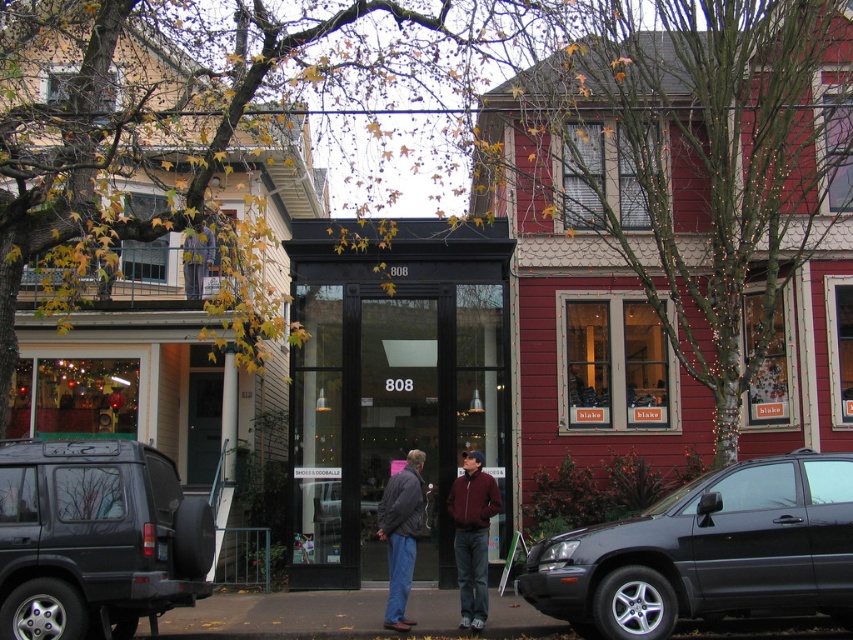
Who is more distant from viewer, [369,248] or [396,577]?

The point [369,248] is behind.

Looking at this image, who is lower down, black glass storefront at center or dark gray jacket at center?

dark gray jacket at center

Does point (296, 424) come closer to viewer compared to point (387, 516)?

No, it is behind (387, 516).

Find the location of a particular element. Image resolution: width=853 pixels, height=640 pixels. black glass storefront at center is located at coordinates (390, 384).

Which is more to the left, shiny black suv at lower right or maroon fabric jacket at center?

From the viewer's perspective, maroon fabric jacket at center appears more on the left side.

Is point (830, 502) positioned in front of point (479, 461)?

Yes, it is in front of point (479, 461).

Is point (730, 580) farther from viewer compared to point (468, 529)?

No, it is in front of (468, 529).

You are a GUI agent. You are given a task and a screenshot of the screen. Output one action in this format:
    pyautogui.click(x=<x>, y=<y>)
    Task: Click on the shiny black suv at lower right
    This screenshot has height=640, width=853.
    Given the screenshot: What is the action you would take?
    pyautogui.click(x=706, y=552)

Between matte black suv at lower left and maroon fabric jacket at center, which one is positioned higher?

matte black suv at lower left is above.

Is matte black suv at lower left smaller than maroon fabric jacket at center?

No.

Which is behind, point (4, 605) or point (483, 518)?

The point (483, 518) is behind.

Find the location of a particular element. This screenshot has width=853, height=640. matte black suv at lower left is located at coordinates (96, 540).